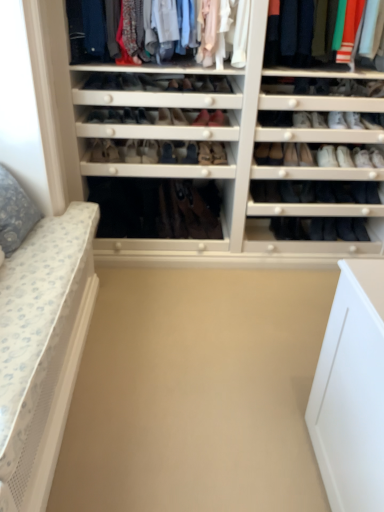
Based on the photo, what is the approximate height of leather brown shoe at center, the eleventh shoe viewed from the right?

4.95 inches.

What do you see at coordinates (196, 392) in the screenshot? I see `beige matte plain at center` at bounding box center [196, 392].

Describe the element at coordinates (188, 211) in the screenshot. The height and width of the screenshot is (512, 384). I see `leather boots at center` at that location.

Find the location of a particular element. This screenshot has height=512, width=384. matte black shoe at center, the sixteenth shoe when ordered from right to left is located at coordinates (132, 152).

Can you confirm if matte black shoe at center, which is counted as the 3th shoe, starting from the left, is smaller than matte black shoe at center, marked as the 12th shoe in a left-to-right arrangement?

Yes, matte black shoe at center, which is counted as the 3th shoe, starting from the left, is smaller than matte black shoe at center, marked as the 12th shoe in a left-to-right arrangement.

Is matte black shoe at center, which is counted as the 3th shoe, starting from the left, touching matte black shoe at center, marked as the 12th shoe in a left-to-right arrangement?

No, matte black shoe at center, which is counted as the 3th shoe, starting from the left, is not with matte black shoe at center, marked as the 12th shoe in a left-to-right arrangement.

Is point (100, 73) closer to camera compared to point (162, 114)?

Yes, it is in front of point (162, 114).

What's the angular difference between matte black shoe at center, arranged as the 21th shoe when viewed from the right, and matte black shoe at center, marked as the 12th shoe in a left-to-right arrangement,'s facing directions?

There is a 4.85-degree angle between the facing directions of matte black shoe at center, arranged as the 21th shoe when viewed from the right, and matte black shoe at center, marked as the 12th shoe in a left-to-right arrangement.

From a real-world perspective, which shoe is the 9th one above the gray dotted pillow at left? Please provide its 2D coordinates.

[(173, 85)]

Considering the relative positions of gray dotted pillow at left and leather shoe at center, which appears as the 14th shoe when viewed from the left, in the image provided, is gray dotted pillow at left to the right of leather shoe at center, which appears as the 14th shoe when viewed from the left, from the viewer's perspective?

No.

Is gray dotted pillow at left shorter than leather shoe at center, the 10th shoe in the right-to-left sequence?

No, gray dotted pillow at left is not shorter than leather shoe at center, the 10th shoe in the right-to-left sequence.

Considering the sizes of objects gray dotted pillow at left and leather shoe at center, the 10th shoe in the right-to-left sequence, in the image provided, who is wider, gray dotted pillow at left or leather shoe at center, the 10th shoe in the right-to-left sequence,?

Wider between the two is leather shoe at center, the 10th shoe in the right-to-left sequence.

Is leather shoe at center, acting as the nineteenth shoe starting from the right, smaller than matte fabric shirts at upper center, which is the 1th clothing in left-to-right order?

Yes, leather shoe at center, acting as the nineteenth shoe starting from the right, is smaller than matte fabric shirts at upper center, which is the 1th clothing in left-to-right order.

Can you confirm if leather shoe at center, which is the 5th shoe from left to right, is wider than matte fabric shirts at upper center, acting as the second clothing starting from the right?

No.

Is leather shoe at center, which is the 5th shoe from left to right, behind matte fabric shirts at upper center, which is the 1th clothing in left-to-right order?

Yes, leather shoe at center, which is the 5th shoe from left to right, is behind matte fabric shirts at upper center, which is the 1th clothing in left-to-right order.

From a real-world perspective, which object stands above the other?

matte fabric shirts at upper center, which is the 1th clothing in left-to-right order.

Considering the positions of objects black suede shoe at center, the 23th shoe when ordered from left to right, and leather boots at center in the image provided, who is in front, black suede shoe at center, the 23th shoe when ordered from left to right, or leather boots at center?

leather boots at center is in front.

From the image's perspective, is black suede shoe at center, the 23th shoe when ordered from left to right, positioned above or below leather boots at center?

black suede shoe at center, the 23th shoe when ordered from left to right, is situated lower than leather boots at center in the image.

Between black suede shoe at center, the 1th shoe when ordered from right to left, and leather boots at center, which one appears on the right side from the viewer's perspective?

Positioned to the right is black suede shoe at center, the 1th shoe when ordered from right to left.

Measure the distance from leather shoe at center, which is the 5th shoe from left to right, to leather at center, arranged as the 14th shoe when viewed from the right.

They are 10.13 inches apart.

Which point is more distant from viewer, (113, 118) or (155, 144)?

Answer: Point (113, 118)

From their relative heights in the image, would you say leather shoe at center, which is the 5th shoe from left to right, is taller or shorter than leather at center, arranged as the 14th shoe when viewed from the right?

Clearly, leather shoe at center, which is the 5th shoe from left to right, is shorter compared to leather at center, arranged as the 14th shoe when viewed from the right.

From a real-world perspective, is leather shoe at center, acting as the nineteenth shoe starting from the right, above or below leather at center, the tenth shoe in the left-to-right sequence?

leather shoe at center, acting as the nineteenth shoe starting from the right, is situated higher than leather at center, the tenth shoe in the left-to-right sequence, in the real world.

Which object is thinner, matte brown shoe at center, acting as the fifth shoe starting from the right, or matte black shoe at center, positioned as the 8th shoe in left-to-right order?

matte brown shoe at center, acting as the fifth shoe starting from the right, is thinner.

Is matte brown shoe at center, acting as the fifth shoe starting from the right, situated inside matte black shoe at center, positioned as the 8th shoe in left-to-right order, or outside?

matte brown shoe at center, acting as the fifth shoe starting from the right, is spatially situated outside matte black shoe at center, positioned as the 8th shoe in left-to-right order.

From a real-world perspective, does matte brown shoe at center, acting as the fifth shoe starting from the right, stand above matte black shoe at center, positioned as the 8th shoe in left-to-right order?

Indeed, from a real-world perspective, matte brown shoe at center, acting as the fifth shoe starting from the right, stands above matte black shoe at center, positioned as the 8th shoe in left-to-right order.

Can you tell me how much matte brown shoe at center, acting as the fifth shoe starting from the right, and matte black shoe at center, positioned as the 8th shoe in left-to-right order, differ in facing direction?

The angular difference between matte brown shoe at center, acting as the fifth shoe starting from the right, and matte black shoe at center, positioned as the 8th shoe in left-to-right order, is 15.1 degrees.

Is leather tan boot at center, the 20th shoe when ordered from left to right, to the left or to the right of leather tan boot at center, the sixth shoe viewed from the right, in the image?

From the image, it's evident that leather tan boot at center, the 20th shoe when ordered from left to right, is to the right of leather tan boot at center, the sixth shoe viewed from the right.

From a real-world perspective, who is located higher, leather tan boot at center, the 4th shoe from the right, or leather tan boot at center, which ranks as the eighteenth shoe in left-to-right order?

From a 3D spatial view, leather tan boot at center, which ranks as the eighteenth shoe in left-to-right order, is above.

Can you tell me how much leather tan boot at center, the 20th shoe when ordered from left to right, and leather tan boot at center, the sixth shoe viewed from the right, differ in facing direction?

They differ by 0.15 degrees in their facing directions.

Is leather tan boot at center, the 20th shoe when ordered from left to right, inside the boundaries of leather tan boot at center, the sixth shoe viewed from the right, or outside?

leather tan boot at center, the 20th shoe when ordered from left to right, exists outside the volume of leather tan boot at center, the sixth shoe viewed from the right.

The width and height of the screenshot is (384, 512). There is a matte black shoe at center, arranged as the 12th shoe when viewed from the right. Find the location of `the 7th shoe above it (from a real-world perspective)`. the 7th shoe above it (from a real-world perspective) is located at coordinates (95, 81).

I want to click on pillow that appears on the left of leather shoe at center, which appears as the 14th shoe when viewed from the left, so click(x=14, y=213).

When comparing their distances from matte black shoe at center, arranged as the 21th shoe when viewed from the right, does matte black shoe at center, arranged as the 7th shoe when viewed from the right, or leather shoe at center, arranged as the 7th shoe when viewed from the left, seem closer?

leather shoe at center, arranged as the 7th shoe when viewed from the left.

Which object lies further to the anchor point leather shoe at center, the sixteenth shoe positioned from the left, black suede shoe at center, the 23th shoe when ordered from left to right, or leather tan boot at center, which ranks as the eighteenth shoe in left-to-right order?

black suede shoe at center, the 23th shoe when ordered from left to right, lies further to leather shoe at center, the sixteenth shoe positioned from the left, than the other object.

Estimate the real-world distances between objects in this image. Which object is closer to leather at center, arranged as the 14th shoe when viewed from the right, beige matte plain at center or leather shoe at center, arranged as the 1th shoe when viewed from the left?

leather shoe at center, arranged as the 1th shoe when viewed from the left, is positioned closer to the anchor leather at center, arranged as the 14th shoe when viewed from the right.

When comparing their distances from matte black shoe at center, which appears as the ninth shoe when viewed from the left, does matte black shoe at center, the thirteenth shoe in the right-to-left sequence, or leather shoe at center, arranged as the 7th shoe when viewed from the left, seem further?

The object further to matte black shoe at center, which appears as the ninth shoe when viewed from the left, is leather shoe at center, arranged as the 7th shoe when viewed from the left.

Based on their spatial positions, is leather shoe at center, the sixteenth shoe positioned from the left, or matte black shoe at center, which ranks as the 15th shoe in right-to-left order, closer to leather shoe at center, the 10th shoe in the right-to-left sequence?

leather shoe at center, the sixteenth shoe positioned from the left, lies closer to leather shoe at center, the 10th shoe in the right-to-left sequence, than the other object.

Considering their positions, is matte black shoe at center, marked as the 12th shoe in a left-to-right arrangement, positioned closer to matte fabric shirts at upper center, acting as the second clothing starting from the right, than leather shoe at center, the 10th shoe in the right-to-left sequence?

leather shoe at center, the 10th shoe in the right-to-left sequence, lies closer to matte fabric shirts at upper center, acting as the second clothing starting from the right, than the other object.

Estimate the real-world distances between objects in this image. Which object is closer to matte fabric shirts at upper center, acting as the second clothing starting from the right, gray dotted pillow at left or matte black shoe at center, the 15th shoe positioned from the left?

Based on the image, matte black shoe at center, the 15th shoe positioned from the left, appears to be nearer to matte fabric shirts at upper center, acting as the second clothing starting from the right.

When comparing their distances from leather brown shoe at center, the eleventh shoe viewed from the right, does leather shoe at center, the sixteenth shoe positioned from the left, or leather tan boot at center, the 20th shoe when ordered from left to right, seem further?

leather shoe at center, the sixteenth shoe positioned from the left, is positioned further to the anchor leather brown shoe at center, the eleventh shoe viewed from the right.

Image resolution: width=384 pixels, height=512 pixels. Identify the location of footwear between matte black shoe at center, which is counted as the 3th shoe, starting from the left, and black suede shoe at center, the 1th shoe when ordered from right to left, from left to right. point(188,211).

Locate an element on the screen. This screenshot has width=384, height=512. footwear between leather shoe at center, which ranks as the second shoe in left-to-right order, and black leather shoe at center, the 21th shoe when ordered from left to right, in the horizontal direction is located at coordinates (188, 211).

The height and width of the screenshot is (512, 384). I want to click on footwear between matte black shoe at center, arranged as the 21th shoe when viewed from the right, and black leather shoe at center, the 22th shoe viewed from the left, so click(188, 211).

Identify the location of clothing between matte black shoe at center, which is counted as the 3th shoe, starting from the left, and matte brown shoe at center, the 19th shoe in the left-to-right sequence, in the horizontal direction. (214, 31).